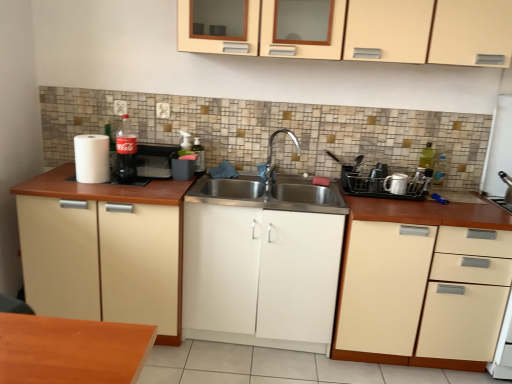
Find the location of a particular element. This screenshot has width=512, height=384. vacant area that lies to the right of white glossy mug at right, the 3th appliance in the left-to-right sequence is located at coordinates (420, 200).